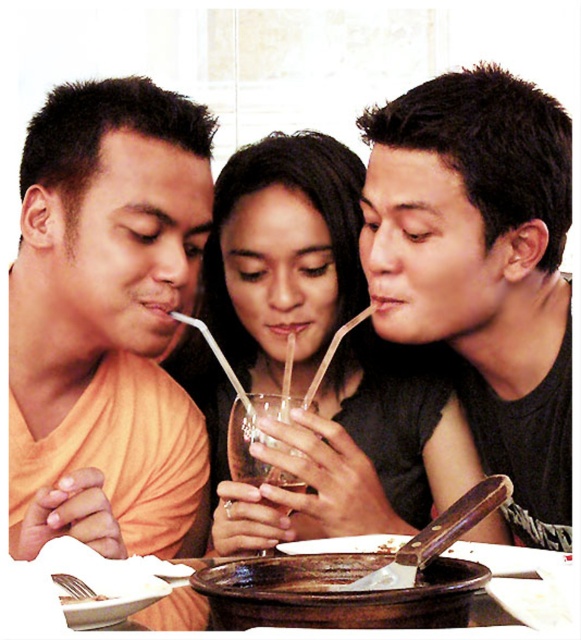
The width and height of the screenshot is (581, 640). Describe the element at coordinates (482, 268) in the screenshot. I see `matte black shirt at center` at that location.

Is point (554, 186) positioned before point (74, 392)?

Yes, it is.

Does point (521, 268) come in front of point (134, 140)?

That is False.

Find the location of a particular element. This screenshot has width=581, height=640. matte black shirt at center is located at coordinates (482, 268).

Who is more forward, (518, 467) or (329, 364)?

Positioned in front is point (518, 467).

Does matte black shirt at center come behind transparent glass cup at center?

Yes, it is.

What do you see at coordinates (482, 268) in the screenshot? I see `matte black shirt at center` at bounding box center [482, 268].

This screenshot has height=640, width=581. Find the location of `matte black shirt at center`. matte black shirt at center is located at coordinates (482, 268).

Consider the image. Can you confirm if orange matte shirt at left is positioned to the right of white paper napkin at lower left?

In fact, orange matte shirt at left is to the left of white paper napkin at lower left.

How much distance is there between orange matte shirt at left and white paper napkin at lower left?

orange matte shirt at left is 15.33 inches from white paper napkin at lower left.

I want to click on orange matte shirt at left, so click(103, 237).